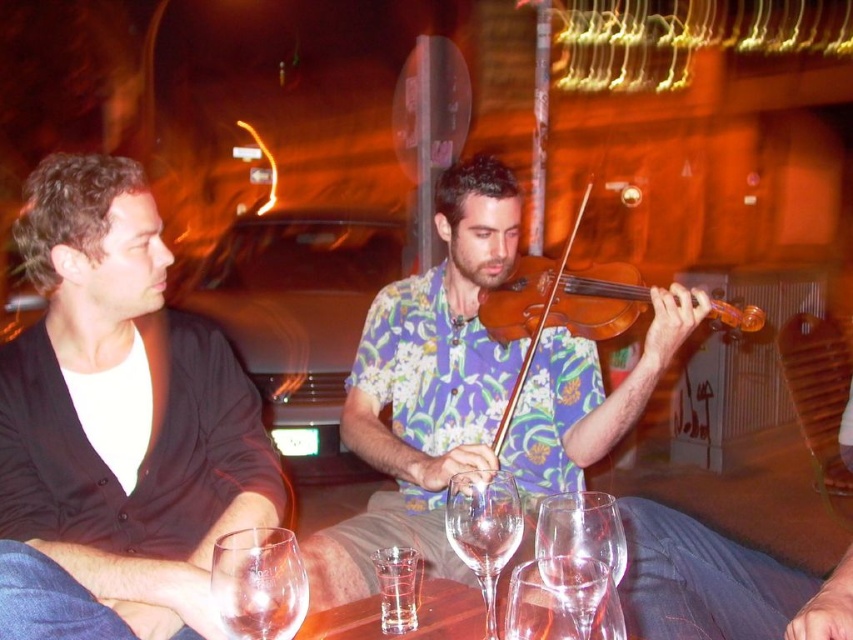
Question: Is wooden violin at center closer to camera compared to transparent glass at lower center?

Choices:
 (A) yes
 (B) no

Answer: (B)

Question: Among these points, which one is farthest from the camera?

Choices:
 (A) (398, 316)
 (B) (524, 362)
 (C) (428, 630)

Answer: (A)

Question: Does wooden violin at center have a smaller size compared to transparent glass wine at table center?

Choices:
 (A) no
 (B) yes

Answer: (A)

Question: Among these objects, which one is nearest to the camera?

Choices:
 (A) wooden violin at center
 (B) clear glassware at center

Answer: (B)

Question: Estimate the real-world distances between objects in this image. Which object is farther from the transparent glass wine glass at lower center?

Choices:
 (A) wooden violin at center
 (B) transparent glass wine glass at center

Answer: (A)

Question: Does transparent glass wine glass at lower center come behind transparent glass wine at table center?

Choices:
 (A) no
 (B) yes

Answer: (B)